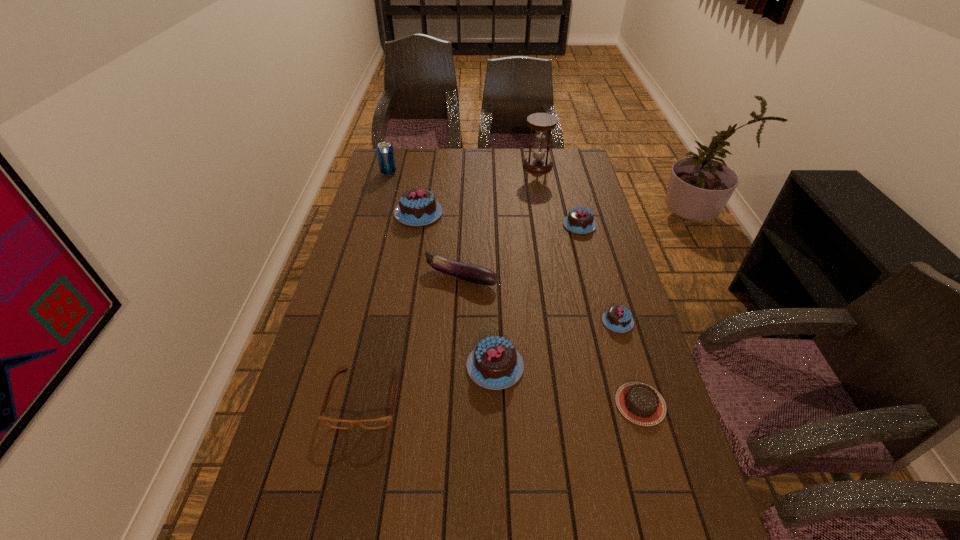
Where is `object present at the far left corner`? Image resolution: width=960 pixels, height=540 pixels. object present at the far left corner is located at coordinates (385, 153).

The width and height of the screenshot is (960, 540). Identify the location of object present at the far right corner. (541, 122).

Locate an element on the screen. vacant space at the far edge of the desktop is located at coordinates (528, 156).

I want to click on free point at the left edge, so click(x=355, y=290).

Identify the location of free space at the right edge of the desktop. The width and height of the screenshot is (960, 540). (600, 284).

The height and width of the screenshot is (540, 960). In the image, there is a desktop. Find the location of `blank space at the far right corner`. blank space at the far right corner is located at coordinates (557, 174).

Where is `free space between the leftmost chocolate cake and the second pink chocolate cake from left to right`? The image size is (960, 540). free space between the leftmost chocolate cake and the second pink chocolate cake from left to right is located at coordinates (457, 290).

Where is `free spot between the second biggest pink chocolate cake and the spectacles`? free spot between the second biggest pink chocolate cake and the spectacles is located at coordinates (430, 383).

Find the location of a particular element. This screenshot has width=960, height=540. vacant area between the second shortest chocolate cake and the biggest pink chocolate cake is located at coordinates (x=518, y=267).

The image size is (960, 540). I want to click on vacant area that lies between the third shortest chocolate cake and the sixth farthest object, so click(598, 273).